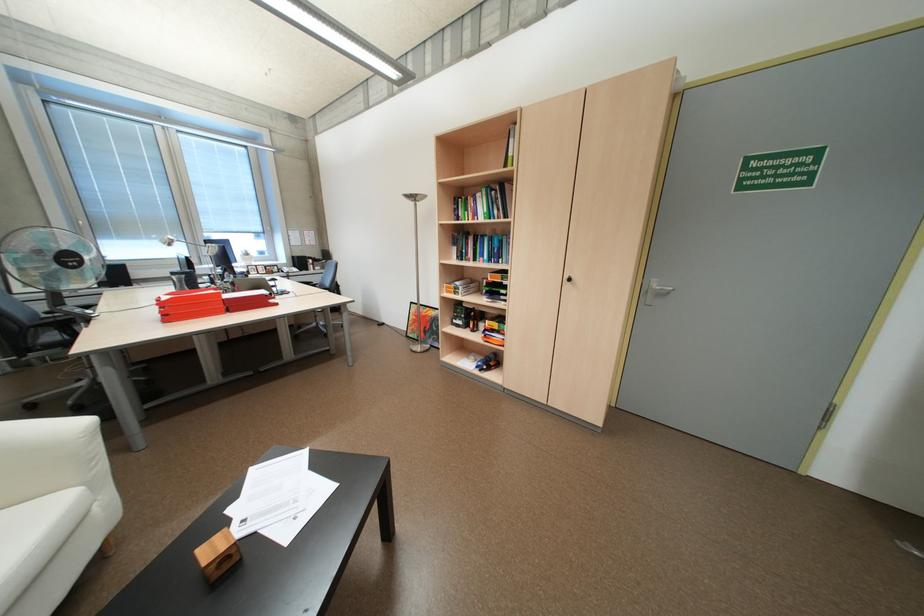
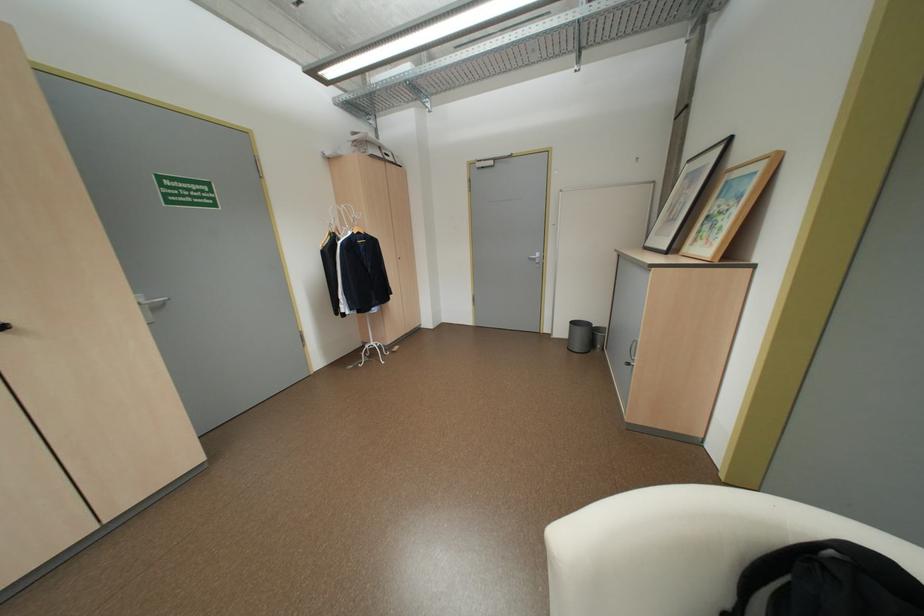
How did the camera likely rotate?

The rotation direction of the camera is right-down.